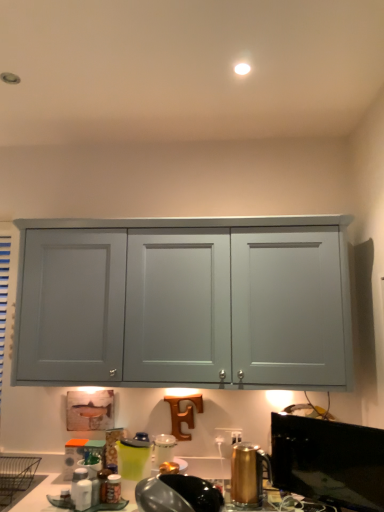
Question: From the image's perspective, does metallic silver toaster at lower center, marked as the 1th appliance in a front-to-back arrangement, appear higher than green plastic pitcher at lower center, acting as the second appliance starting from the left?

Choices:
 (A) no
 (B) yes

Answer: (B)

Question: From the image's perspective, would you say metallic silver toaster at lower center, the 2th appliance when ordered from right to left, is shown under green plastic pitcher at lower center, the 3th appliance when ordered from right to left?

Choices:
 (A) yes
 (B) no

Answer: (B)

Question: From a real-world perspective, does metallic silver toaster at lower center, the 2th appliance when ordered from right to left, sit lower than green plastic pitcher at lower center, acting as the second appliance starting from the left?

Choices:
 (A) no
 (B) yes

Answer: (B)

Question: Considering the relative sizes of metallic silver toaster at lower center, the 2th appliance when ordered from right to left, and green plastic pitcher at lower center, acting as the second appliance starting from the left, in the image provided, is metallic silver toaster at lower center, the 2th appliance when ordered from right to left, bigger than green plastic pitcher at lower center, acting as the second appliance starting from the left,?

Choices:
 (A) no
 (B) yes

Answer: (B)

Question: Does metallic silver toaster at lower center, which is the 4th appliance from back to front, lie in front of green plastic pitcher at lower center, which is the third appliance from front to back?

Choices:
 (A) yes
 (B) no

Answer: (A)

Question: Does metallic silver toaster at lower center, the 2th appliance when ordered from right to left, have a greater width compared to green plastic pitcher at lower center, which is the third appliance from front to back?

Choices:
 (A) yes
 (B) no

Answer: (A)

Question: Does gold metallic kettle at lower right, the 4th appliance in the left-to-right sequence, have a greater height compared to metallic silver toaster at lower center, marked as the third appliance in a left-to-right arrangement?

Choices:
 (A) no
 (B) yes

Answer: (B)

Question: Does gold metallic kettle at lower right, the 1th appliance in the right-to-left sequence, lie behind metallic silver toaster at lower center, the 2th appliance when ordered from right to left?

Choices:
 (A) no
 (B) yes

Answer: (B)

Question: From a real-world perspective, is gold metallic kettle at lower right, the 1th appliance in the right-to-left sequence, on top of metallic silver toaster at lower center, marked as the third appliance in a left-to-right arrangement?

Choices:
 (A) no
 (B) yes

Answer: (B)

Question: Is the surface of gold metallic kettle at lower right, the 4th appliance in the left-to-right sequence, in direct contact with metallic silver toaster at lower center, marked as the third appliance in a left-to-right arrangement?

Choices:
 (A) yes
 (B) no

Answer: (B)

Question: From the image's perspective, is gold metallic kettle at lower right, which is the third appliance in back-to-front order, beneath metallic silver toaster at lower center, marked as the 1th appliance in a front-to-back arrangement?

Choices:
 (A) no
 (B) yes

Answer: (B)

Question: Does gold metallic kettle at lower right, which is the third appliance in back-to-front order, have a lesser width compared to metallic silver toaster at lower center, the 2th appliance when ordered from right to left?

Choices:
 (A) yes
 (B) no

Answer: (A)

Question: Is green plastic pitcher at lower center, acting as the second appliance starting from the left, taller than matte plastic container at lower left, the fourth appliance viewed from the right?

Choices:
 (A) no
 (B) yes

Answer: (B)